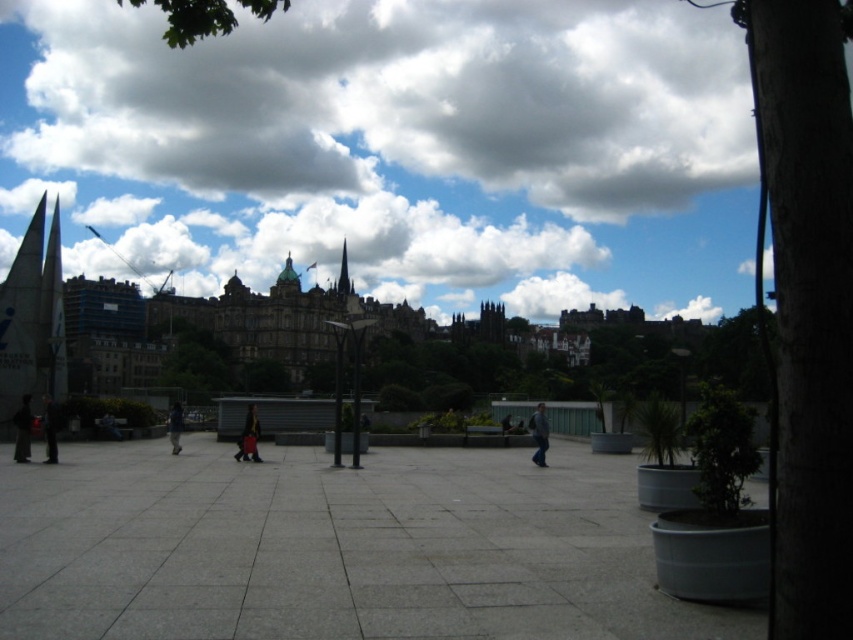
Question: Which point is closer to the camera?

Choices:
 (A) (538, 460)
 (B) (132, 19)
 (C) (45, 404)
 (D) (180, 404)

Answer: (C)

Question: Which point appears closest to the camera in this image?

Choices:
 (A) (13, 419)
 (B) (337, 280)

Answer: (A)

Question: Is dark matte coat at lower left smaller than dark blue jeans at center?

Choices:
 (A) yes
 (B) no

Answer: (A)

Question: Does dark gray jacket at left have a smaller size compared to dark blue jeans at center?

Choices:
 (A) no
 (B) yes

Answer: (B)

Question: Does cloudy sky at upper center have a greater width compared to dark gray jacket at left?

Choices:
 (A) no
 (B) yes

Answer: (B)

Question: Which object is positioned closest to the cloudy sky at upper center?

Choices:
 (A) dark gray jacket at left
 (B) matte black suitcase at center

Answer: (B)